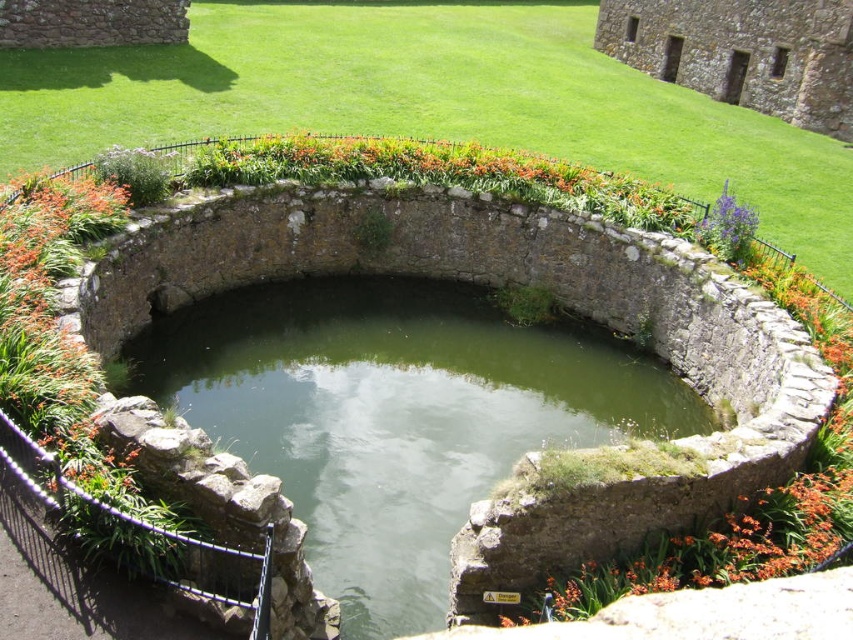
Question: Which point is farther to the camera?

Choices:
 (A) green stone water at center
 (B) purple matte flower at upper right

Answer: (B)

Question: Observing the image, what is the correct spatial positioning of green stone water at center in reference to purple matte flower at upper right?

Choices:
 (A) above
 (B) below

Answer: (B)

Question: Is green stone water at center positioned behind purple matte flower at upper right?

Choices:
 (A) no
 (B) yes

Answer: (A)

Question: Which of the following is the farthest from the observer?

Choices:
 (A) (741, 236)
 (B) (242, 307)

Answer: (B)

Question: Is green stone water at center further to camera compared to purple matte flower at upper right?

Choices:
 (A) yes
 (B) no

Answer: (B)